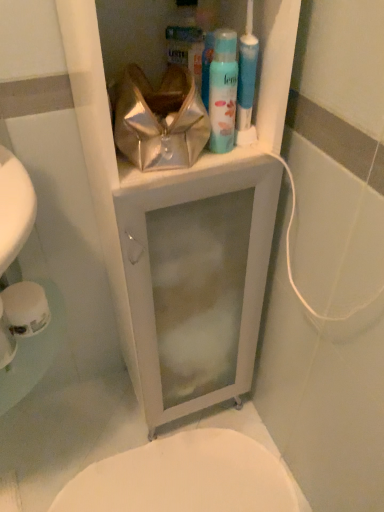
Locate an element on the screen. The image size is (384, 512). vacant space situated above white glossy bidet at lower center (from a real-world perspective) is located at coordinates (181, 476).